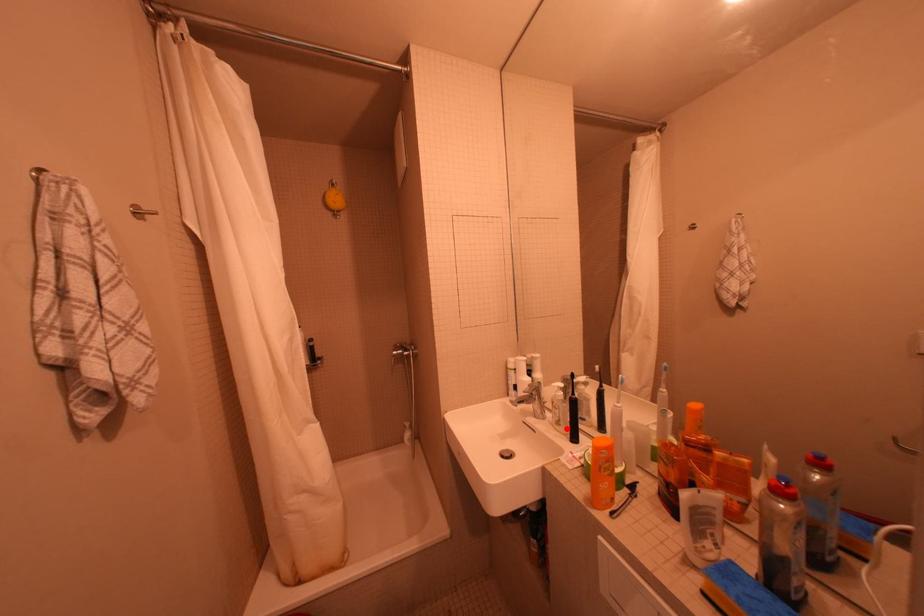
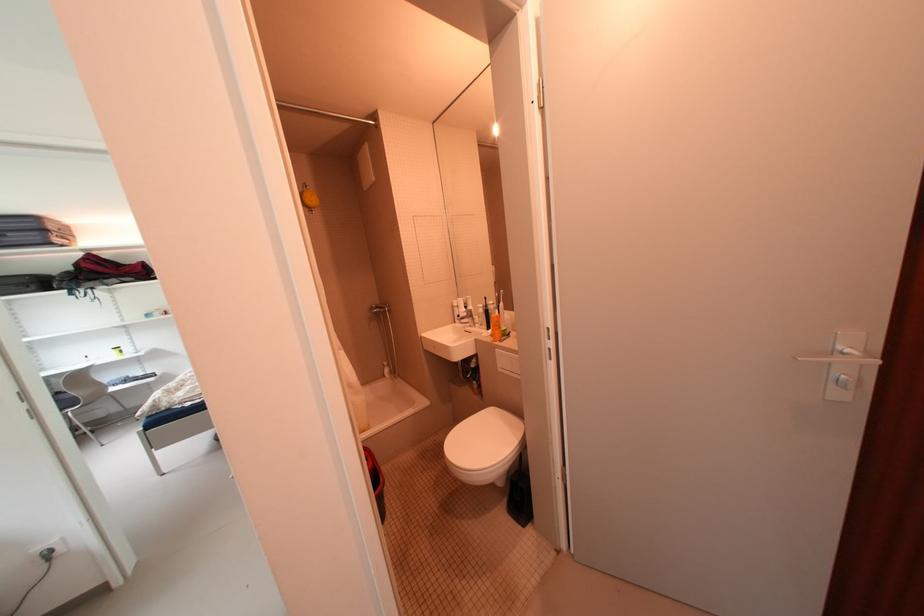
Question: I am providing you with two images of the same scene from different viewpoints. A red point is marked on the first image. At the location where the point appears in image 1, is it still visible in image 2?

Choices:
 (A) Yes
 (B) No

Answer: (A)